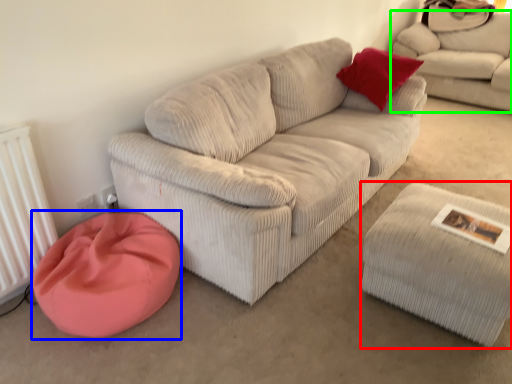
Question: Based on their relative distances, which object is farther from stool (highlighted by a red box)? Choose from cat bed (highlighted by a blue box) and studio couch (highlighted by a green box).

Choices:
 (A) cat bed
 (B) studio couch

Answer: (B)